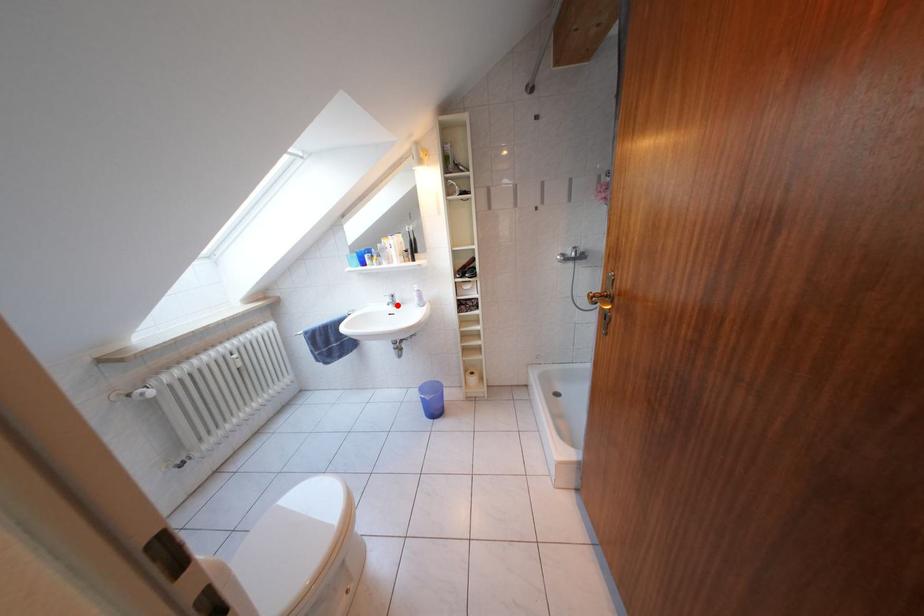
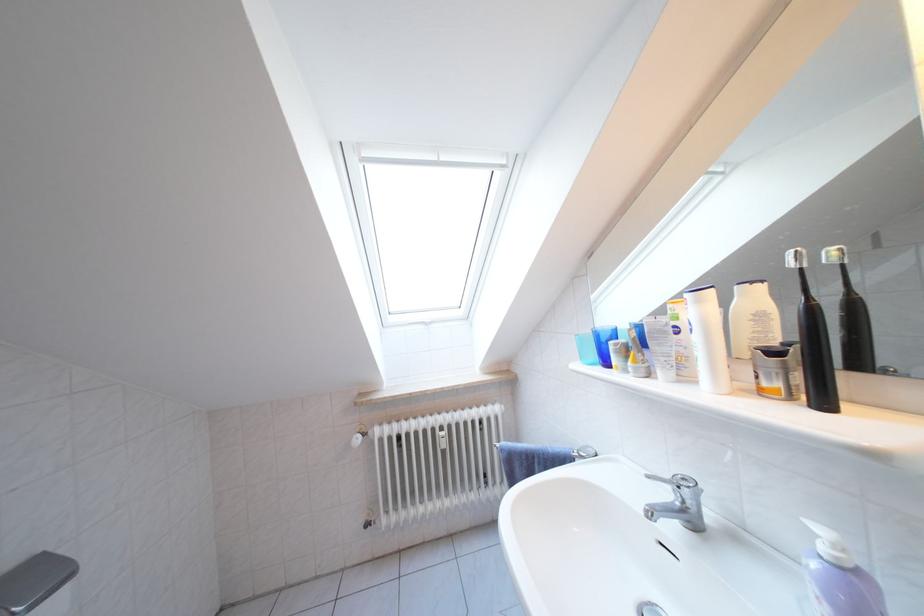
Find the pixel in the second image that matches the highlighted location in the first image.

(675, 500)